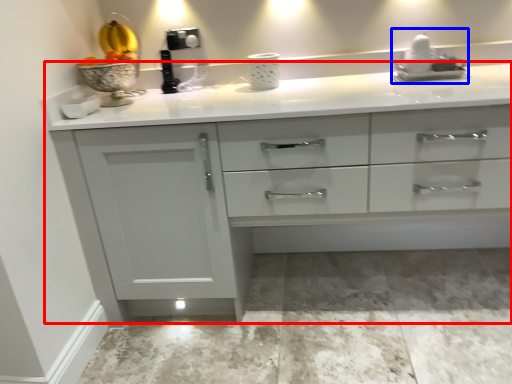
Question: Which point is further to the camera, countertop (highlighted by a red box) or sink (highlighted by a blue box)?

Choices:
 (A) countertop
 (B) sink

Answer: (B)